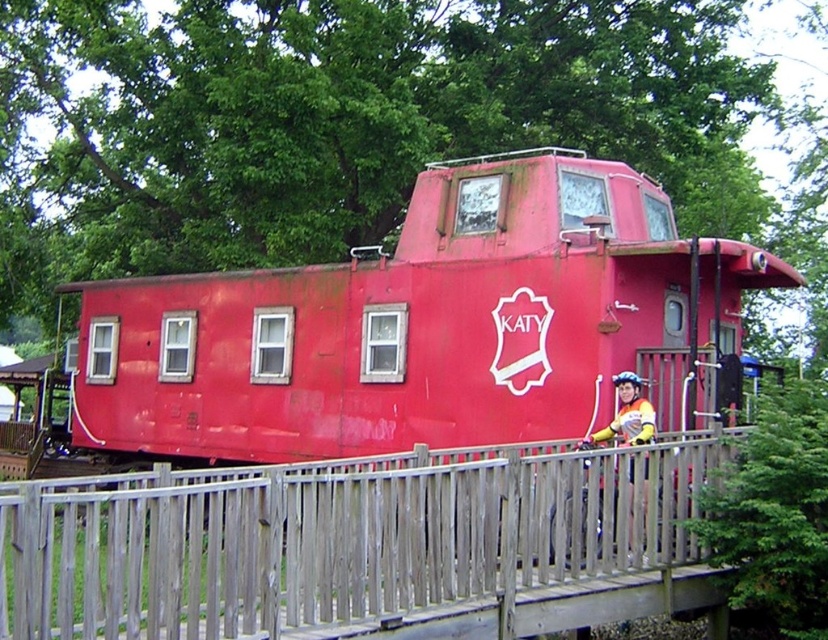
Based on the scene description, where is the rusty red caboose at center located in terms of its 2D coordinates?

The rusty red caboose at center is located at the 2D coordinates of point (x=417, y=324).